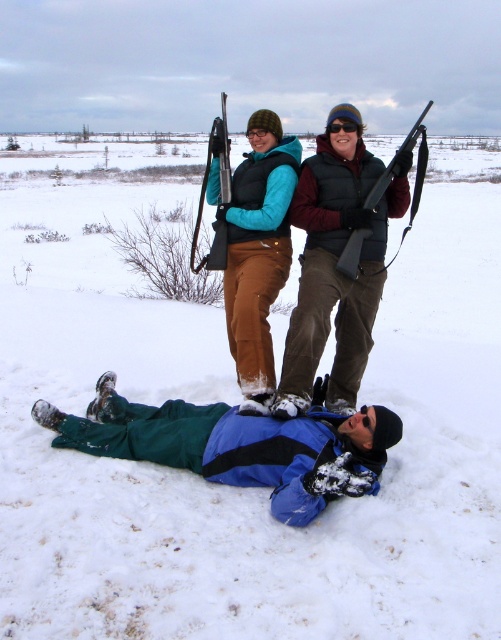
Is blue fleece jacket at lower center taller than matte black vest at upper center?

No, blue fleece jacket at lower center is not taller than matte black vest at upper center.

Does point (326, 472) come behind point (398, 156)?

No, (326, 472) is in front of (398, 156).

Who is more distant from viewer, (299, 508) or (341, 113)?

Positioned behind is point (341, 113).

The width and height of the screenshot is (501, 640). I want to click on blue fleece jacket at lower center, so click(238, 444).

Between point (355, 310) and point (354, 128), which one is positioned behind?

Point (355, 310)

Does matte black vest at upper center lie behind black plastic goggles at upper center?

That is False.

Is point (338, 225) behind point (330, 131)?

No, it is not.

Find the location of a particular element. Image resolution: width=501 pixels, height=640 pixels. matte black vest at upper center is located at coordinates (297, 205).

In the scene shown: Does blue fleece jacket at lower center have a lesser width compared to black plastic goggles at upper center?

No.

Which of these two, blue fleece jacket at lower center or black plastic goggles at upper center, stands taller?

blue fleece jacket at lower center is taller.

Is point (339, 474) closer to camera compared to point (330, 129)?

Yes, point (339, 474) is in front of point (330, 129).

Identify the location of blue fleece jacket at lower center. The image size is (501, 640). (238, 444).